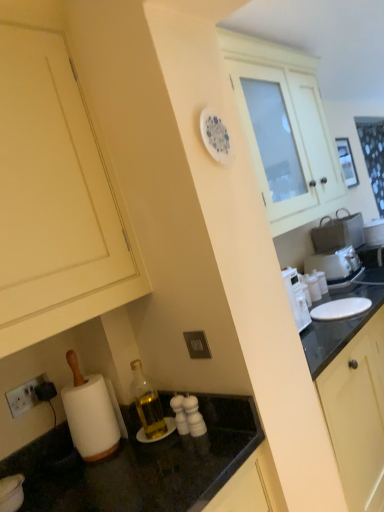
Question: Should I look upward or downward to see white plastic toaster at right?

Choices:
 (A) up
 (B) down

Answer: (B)

Question: From the image's perspective, does matte cream cabinet at lower left, the first cabinetry when ordered from front to back, appear lower than white plastic toaster at right?

Choices:
 (A) yes
 (B) no

Answer: (B)

Question: Is matte cream cabinet at lower left, which is the second cabinetry from right to left, outside white plastic toaster at right?

Choices:
 (A) yes
 (B) no

Answer: (A)

Question: Considering the relative sizes of matte cream cabinet at lower left, placed as the first cabinetry when sorted from left to right, and white plastic toaster at right in the image provided, is matte cream cabinet at lower left, placed as the first cabinetry when sorted from left to right, smaller than white plastic toaster at right?

Choices:
 (A) yes
 (B) no

Answer: (B)

Question: Can you confirm if matte cream cabinet at lower left, placed as the first cabinetry when sorted from left to right, is thinner than white plastic toaster at right?

Choices:
 (A) no
 (B) yes

Answer: (A)

Question: Is matte cream cabinet at lower left, placed as the first cabinetry when sorted from left to right, next to white plastic toaster at right?

Choices:
 (A) no
 (B) yes

Answer: (A)

Question: Is matte cream cabinet at lower left, the first cabinetry when ordered from front to back, wider than white plastic toaster at right?

Choices:
 (A) no
 (B) yes

Answer: (B)

Question: Is white glossy cabinet at upper center, placed as the 2th cabinetry when sorted from front to back, positioned in front of matte cream cabinet at lower left, the first cabinetry when ordered from front to back?

Choices:
 (A) no
 (B) yes

Answer: (A)

Question: Can you confirm if white glossy cabinet at upper center, placed as the 2th cabinetry when sorted from front to back, is smaller than matte cream cabinet at lower left, the first cabinetry when ordered from front to back?

Choices:
 (A) yes
 (B) no

Answer: (B)

Question: From the image's perspective, does white glossy cabinet at upper center, which appears as the 1th cabinetry when viewed from the back, appear higher than matte cream cabinet at lower left, the 2th cabinetry from the back?

Choices:
 (A) no
 (B) yes

Answer: (B)

Question: Is the depth of white glossy cabinet at upper center, which appears as the 1th cabinetry when viewed from the right, greater than that of matte cream cabinet at lower left, the first cabinetry when ordered from front to back?

Choices:
 (A) yes
 (B) no

Answer: (A)

Question: Is white glossy cabinet at upper center, which appears as the 1th cabinetry when viewed from the back, not near matte cream cabinet at lower left, the 2th cabinetry from the back?

Choices:
 (A) yes
 (B) no

Answer: (A)

Question: Considering the relative sizes of white glossy cabinet at upper center, positioned as the second cabinetry in left-to-right order, and matte cream cabinet at lower left, the first cabinetry when ordered from front to back, in the image provided, is white glossy cabinet at upper center, positioned as the second cabinetry in left-to-right order, wider than matte cream cabinet at lower left, the first cabinetry when ordered from front to back,?

Choices:
 (A) no
 (B) yes

Answer: (A)

Question: From the image's perspective, is matte cream cabinet at lower left, placed as the first cabinetry when sorted from left to right, under white glossy cabinet at upper center, which appears as the 1th cabinetry when viewed from the right?

Choices:
 (A) yes
 (B) no

Answer: (A)